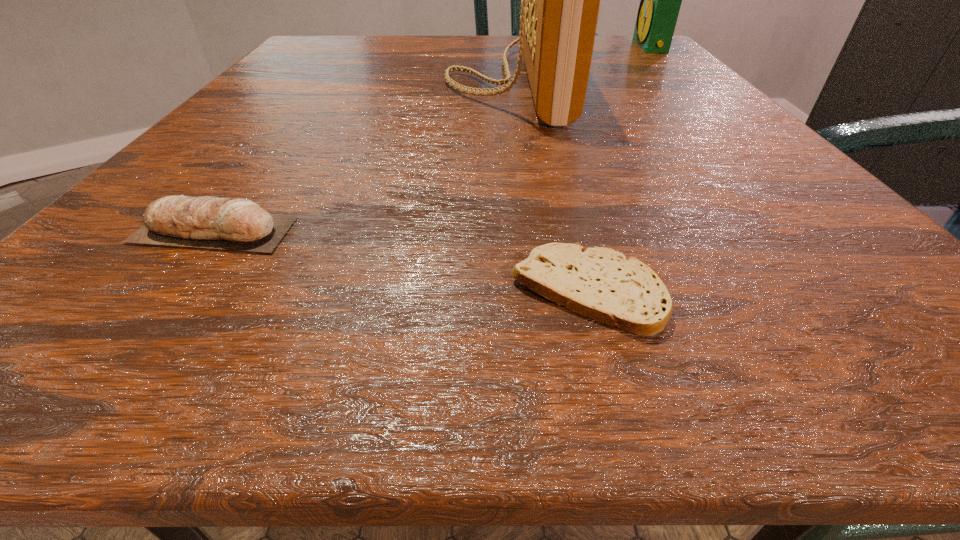
This screenshot has height=540, width=960. Find the location of `object that is at the far right corner`. object that is at the far right corner is located at coordinates (660, 0).

Image resolution: width=960 pixels, height=540 pixels. I want to click on free spot at the far edge of the desktop, so click(391, 66).

The height and width of the screenshot is (540, 960). Identify the location of vacant point at the near edge. (715, 313).

Locate an element on the screen. free spot at the left edge of the desktop is located at coordinates (263, 90).

Locate an element on the screen. Image resolution: width=960 pixels, height=540 pixels. free space at the right edge of the desktop is located at coordinates (641, 76).

The image size is (960, 540). Identify the location of free space at the far left corner of the desktop. [x=352, y=40].

The width and height of the screenshot is (960, 540). I want to click on vacant space at the far right corner of the desktop, so click(628, 63).

In order to click on vacant space at the near right corner of the desktop in this screenshot , I will do `click(811, 322)`.

You are a GUI agent. You are given a task and a screenshot of the screen. Output one action in this format:
    pyautogui.click(x=<x>, y=<y>)
    Task: Click on the empty space between the right pita bread and the left pita bread
    This screenshot has width=960, height=540.
    Given the screenshot: What is the action you would take?
    pyautogui.click(x=400, y=261)

At what (x,y) coordinates should I click in order to perform the action: click on vacant point located between the left pita bread and the rightmost object. Please return your answer as a coordinate pair (x, y). This screenshot has width=960, height=540. Looking at the image, I should click on (432, 138).